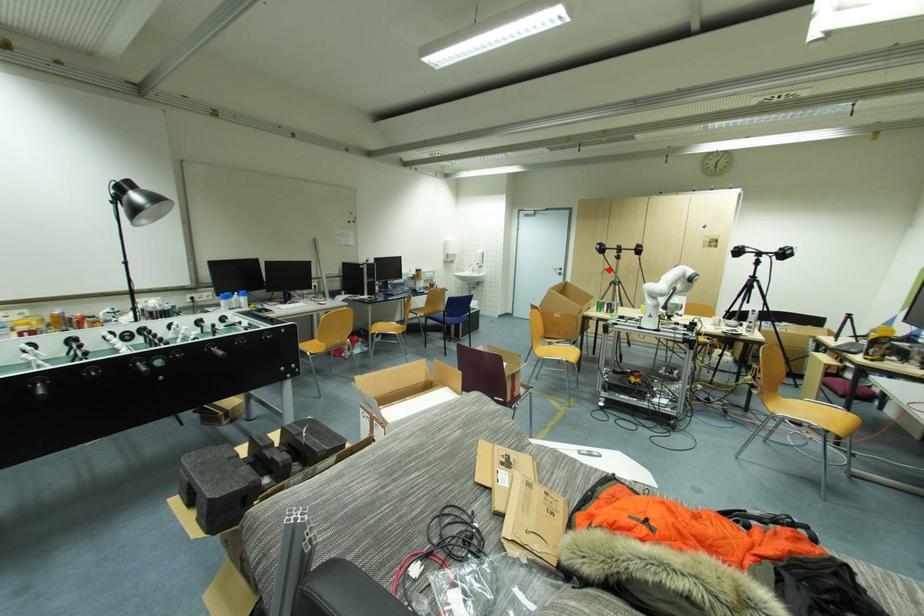
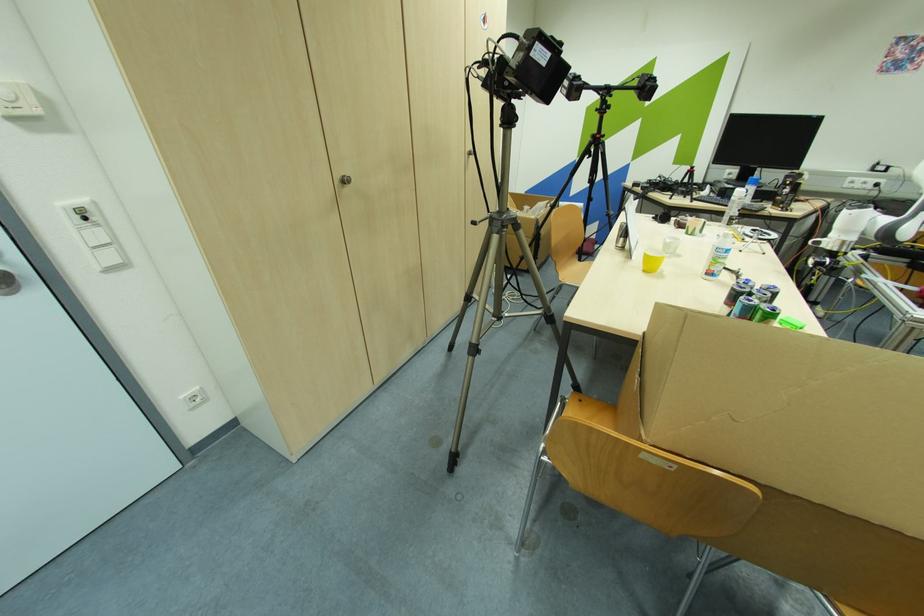
Locate, in the second image, the point that corresponds to the highlighted location in the first image.

(348, 182)